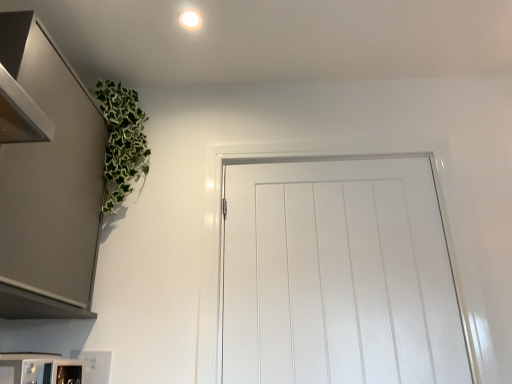
Question: Is there a large distance between white glossy microwave at lower left and white glossy light fixture at upper center?

Choices:
 (A) no
 (B) yes

Answer: (B)

Question: From the image's perspective, is white glossy microwave at lower left under white glossy light fixture at upper center?

Choices:
 (A) no
 (B) yes

Answer: (B)

Question: Is white glossy microwave at lower left bigger than white glossy light fixture at upper center?

Choices:
 (A) yes
 (B) no

Answer: (A)

Question: Is white glossy microwave at lower left in contact with white glossy light fixture at upper center?

Choices:
 (A) no
 (B) yes

Answer: (A)

Question: From a real-world perspective, is white glossy microwave at lower left over white glossy light fixture at upper center?

Choices:
 (A) no
 (B) yes

Answer: (A)

Question: Is white glossy microwave at lower left positioned in front of white glossy light fixture at upper center?

Choices:
 (A) no
 (B) yes

Answer: (B)

Question: Is satin metallic cabinet at upper left at the back of white glossy light fixture at upper center?

Choices:
 (A) no
 (B) yes

Answer: (A)

Question: Considering the relative sizes of white glossy light fixture at upper center and satin metallic cabinet at upper left in the image provided, is white glossy light fixture at upper center wider than satin metallic cabinet at upper left?

Choices:
 (A) yes
 (B) no

Answer: (B)

Question: From a real-world perspective, is white glossy light fixture at upper center below satin metallic cabinet at upper left?

Choices:
 (A) no
 (B) yes

Answer: (A)

Question: Considering the relative positions of white glossy light fixture at upper center and satin metallic cabinet at upper left in the image provided, is white glossy light fixture at upper center to the right of satin metallic cabinet at upper left from the viewer's perspective?

Choices:
 (A) no
 (B) yes

Answer: (B)

Question: Is white glossy light fixture at upper center located outside satin metallic cabinet at upper left?

Choices:
 (A) yes
 (B) no

Answer: (A)

Question: Considering the relative sizes of white glossy light fixture at upper center and satin metallic cabinet at upper left in the image provided, is white glossy light fixture at upper center shorter than satin metallic cabinet at upper left?

Choices:
 (A) yes
 (B) no

Answer: (A)

Question: From a real-world perspective, is white glossy light fixture at upper center located beneath white glossy door at center?

Choices:
 (A) yes
 (B) no

Answer: (B)